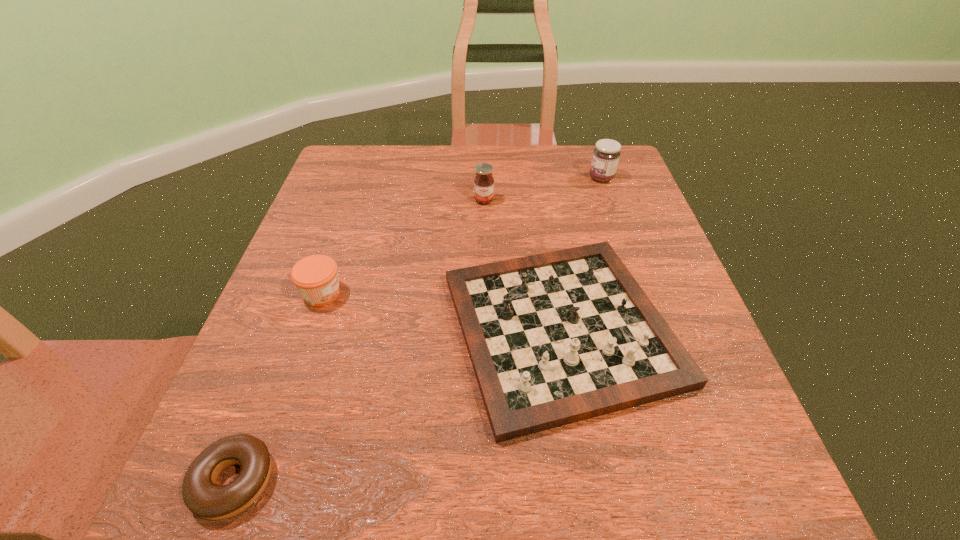
Locate an element on the screen. the rightmost jam is located at coordinates (606, 154).

This screenshot has width=960, height=540. In order to click on the farthest object in this screenshot , I will do `click(606, 154)`.

Locate an element on the screen. The width and height of the screenshot is (960, 540). the second nearest jam is located at coordinates (484, 182).

This screenshot has width=960, height=540. I want to click on the second jam from left to right, so click(x=484, y=182).

Locate an element on the screen. chessboard is located at coordinates (555, 338).

Find the location of a particular element. This screenshot has width=960, height=540. the leftmost jam is located at coordinates (315, 276).

In order to click on the shortest jam in this screenshot , I will do `click(315, 276)`.

At what (x,y) coordinates should I click in order to perform the action: click on doughnut. Please return your answer as a coordinate pair (x, y). Image resolution: width=960 pixels, height=540 pixels. Looking at the image, I should click on (201, 495).

Find the location of a particular element. The width and height of the screenshot is (960, 540). free space located on the front label of the rightmost jam is located at coordinates (507, 178).

Locate an element on the screen. The height and width of the screenshot is (540, 960). free spot located 0.190m on the front label of the rightmost jam is located at coordinates (515, 178).